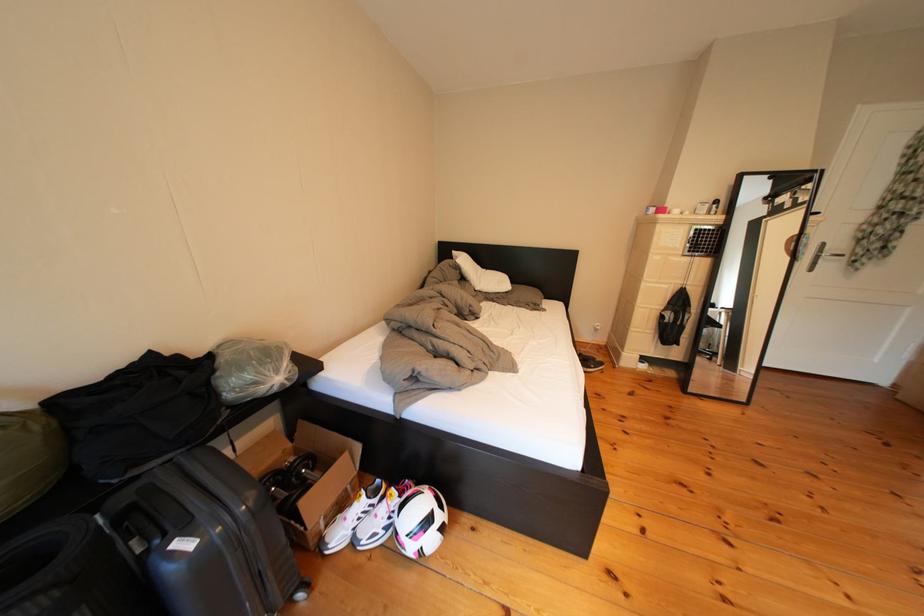
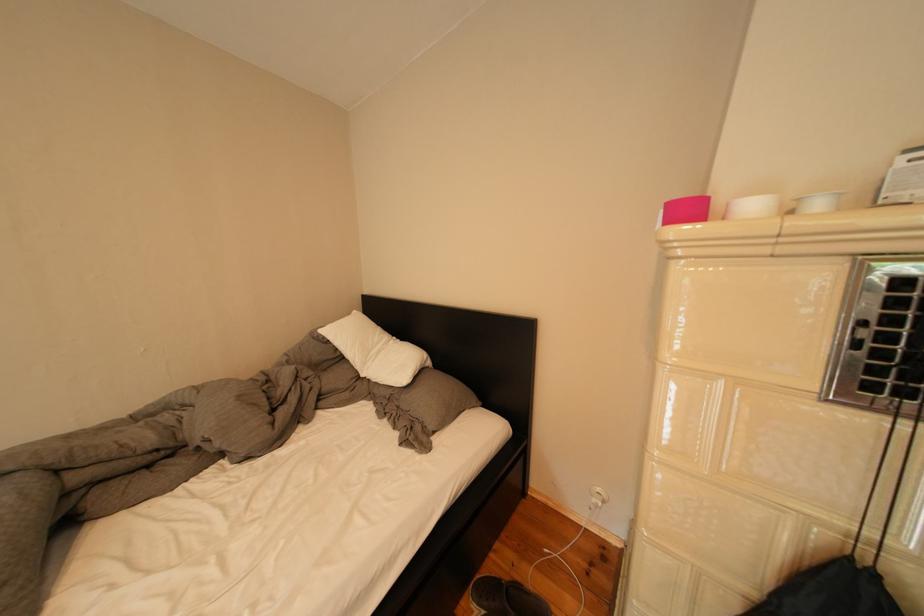
Which direction would the cameraman need to move to produce the second image?

The cameraman moved toward right, forward.